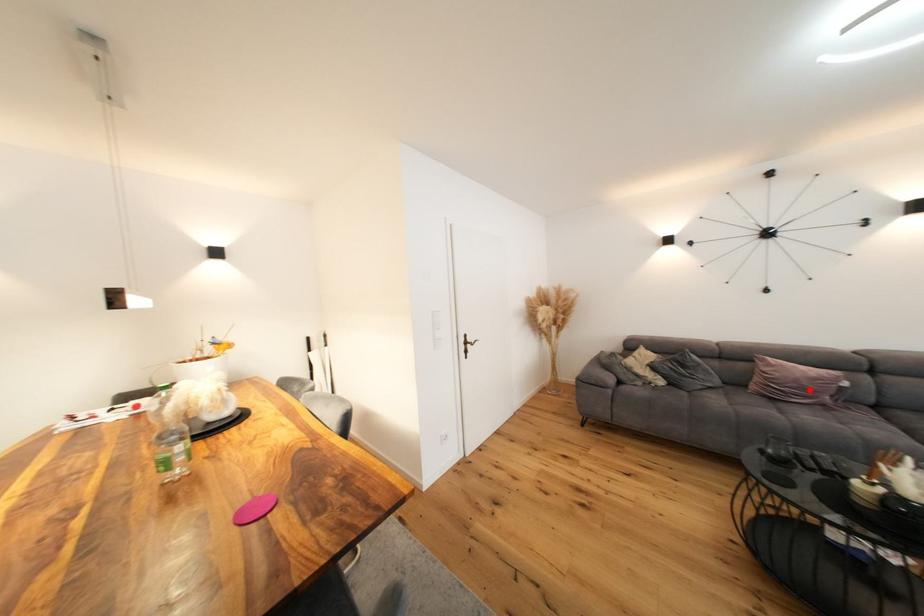
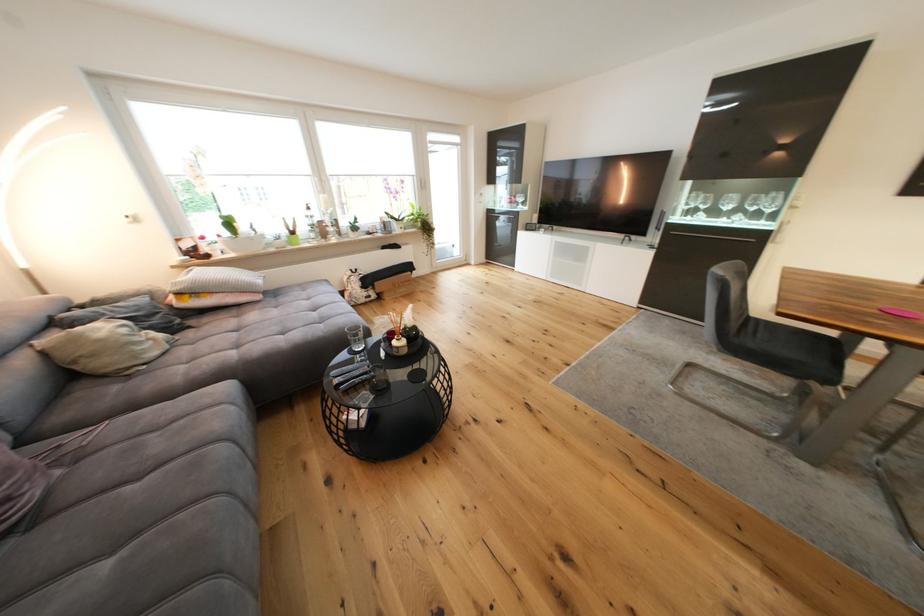
Question: I am providing you with two images of the same scene from different viewpoints. A red point is shown in image1. For the corresponding object point in image2, is it positioned nearer or farther from the camera?

Choices:
 (A) Nearer
 (B) Farther

Answer: (B)